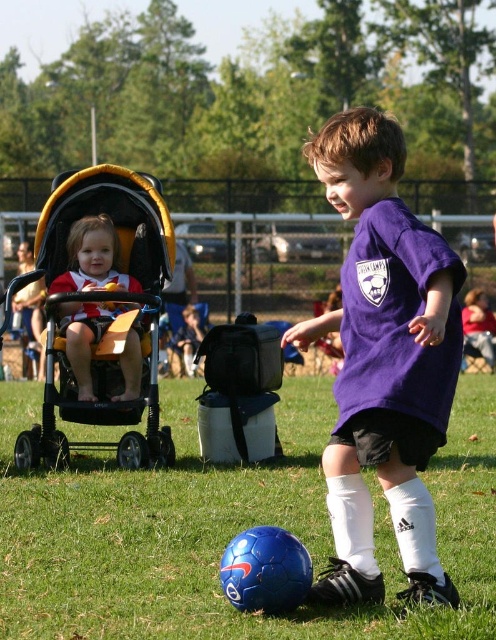
You are a photographer trying to capture a photo of the purple matte shirt at center and the yellow fabric stroller at left. If you want to ensure both objects are fully visible in the frame, which object should you position closer to the camera?

The purple matte shirt at center is thinner than the yellow fabric stroller at left, so you should position the purple matte shirt at center closer to the camera to ensure both are fully visible.

You are standing at the edge of the soccer field and want to walk towards the two points marked in the image. Which point will you reach first, point (477, 596) or point (343, 588)?

Point (477, 596) is further to the viewer than point (343, 588), so you will reach point (477, 596) first.

You are a photographer trying to capture the soccer game. You notice the green grass at lower center and the purple matte shirt at center. Which object appears narrower in the photo?

The green grass at lower center has a lesser width compared to the purple matte shirt at center, so it appears narrower in the photo.